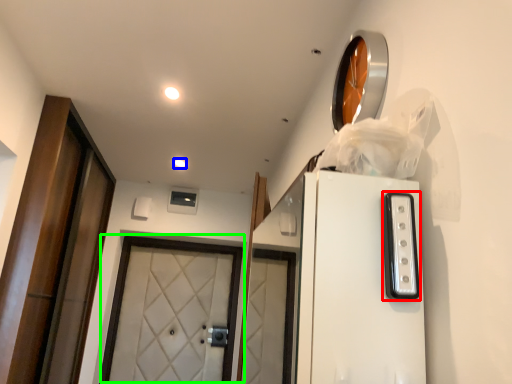
Question: Which is farther away from appliance (highlighted by a red box)? lighting (highlighted by a blue box) or door (highlighted by a green box)?

Choices:
 (A) lighting
 (B) door

Answer: (B)